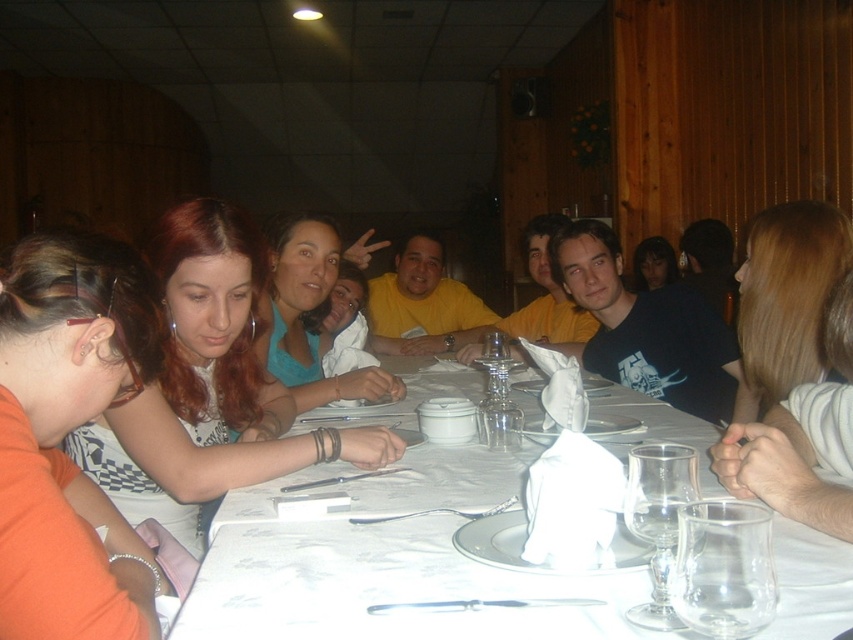
Question: Which object is the farthest from the white paper napkin at center?

Choices:
 (A) matte black hair at center
 (B) blonde hair at upper right

Answer: (A)

Question: Observing the image, what is the correct spatial positioning of white paper napkin at center in reference to blonde hair at upper right?

Choices:
 (A) below
 (B) above

Answer: (A)

Question: Is matte orange shirt at lower left positioned before transparent glass wine glass at center?

Choices:
 (A) yes
 (B) no

Answer: (A)

Question: From the image, what is the correct spatial relationship of white paper napkin at center in relation to transparent glass at table center?

Choices:
 (A) right
 (B) left

Answer: (B)

Question: Among these points, which one is nearest to the camera?

Choices:
 (A) (820, 317)
 (B) (674, 598)

Answer: (B)

Question: Which object appears farthest from the camera in this image?

Choices:
 (A) transparent glass wine glass at center
 (B) matte black hair at center
 (C) matte white shirt at center
 (D) blonde hair at upper right

Answer: (B)